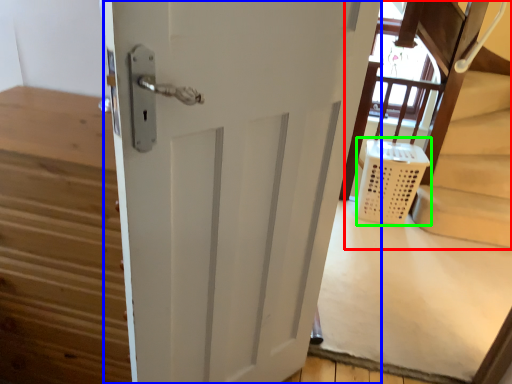
Question: Which object is the closest to the bunk bed (highlighted by a red box)? Choose among these: door (highlighted by a blue box) or laundry basket (highlighted by a green box).

Choices:
 (A) door
 (B) laundry basket

Answer: (B)